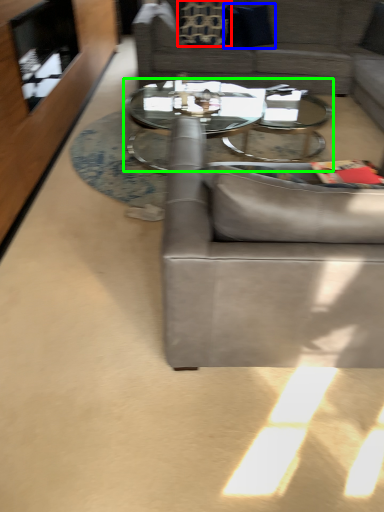
Question: Estimate the real-world distances between objects in this image. Which object is farther from pillow (highlighted by a red box), pillow (highlighted by a blue box) or coffee table (highlighted by a green box)?

Choices:
 (A) pillow
 (B) coffee table

Answer: (B)